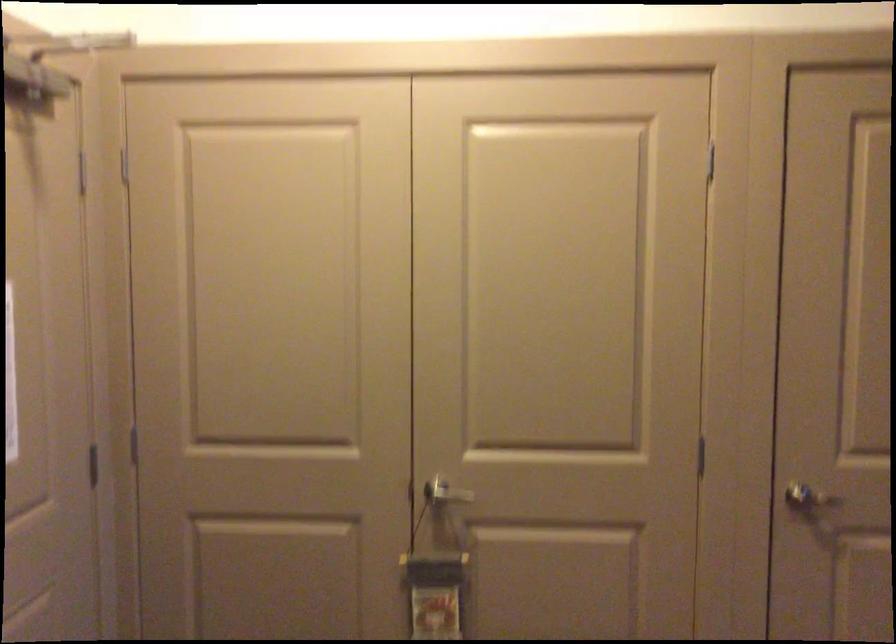
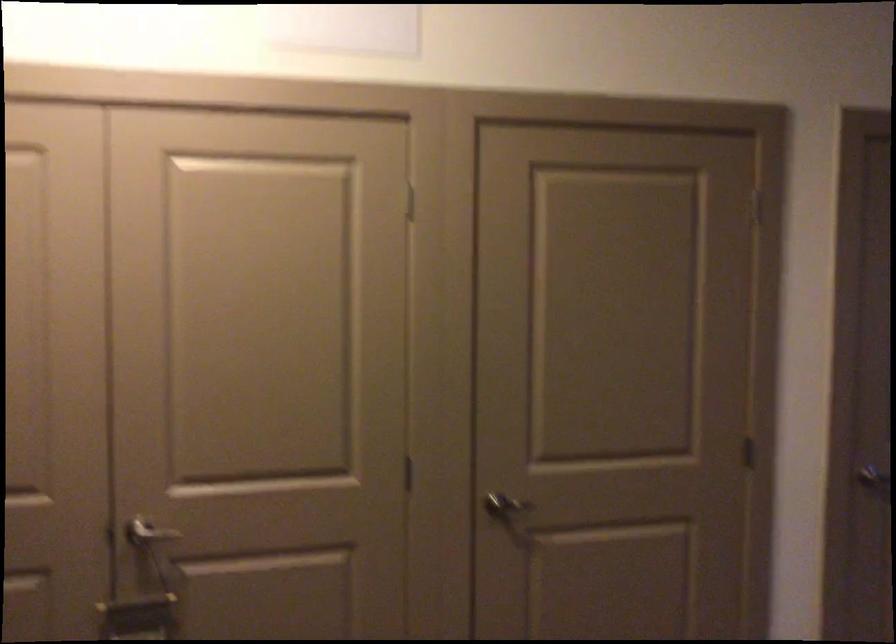
Question: What movement of the cameraman would produce the second image?

Choices:
 (A) Left
 (B) Right
 (C) Forward
 (D) Backward

Answer: (B)